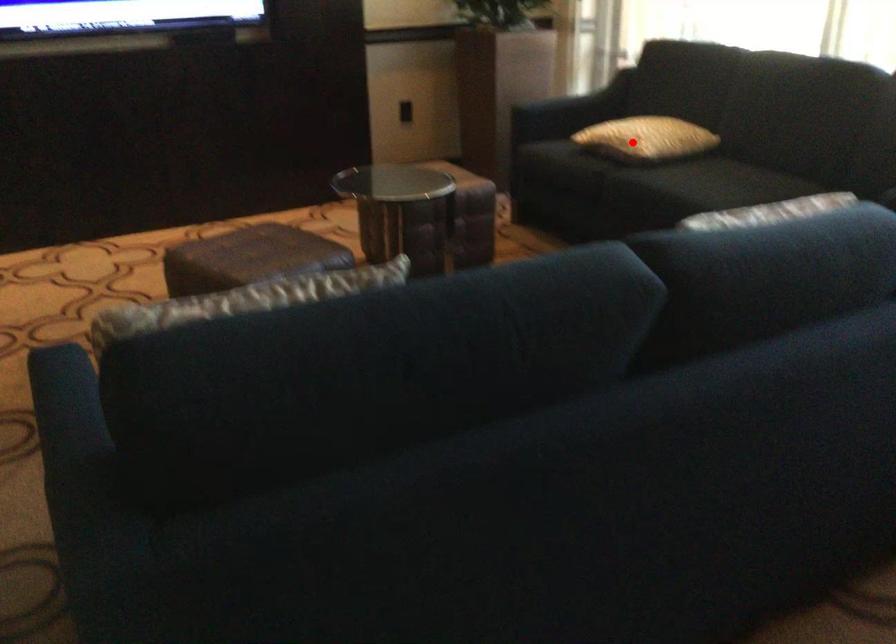
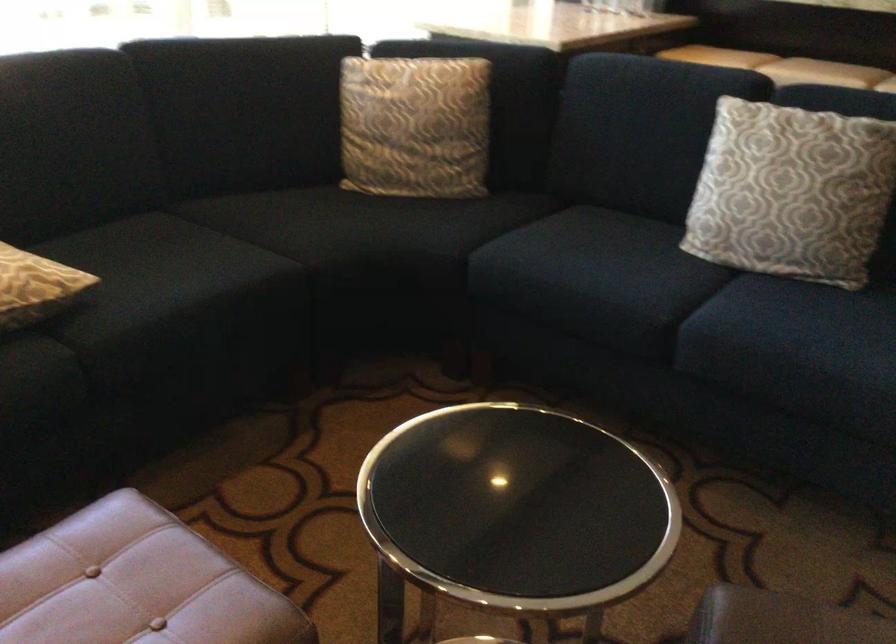
Question: A red point is marked in image1. In image2, is the corresponding 3D point closer to the camera or farther? Reply with the corresponding letter.

Choices:
 (A) The corresponding 3D point is closer.
 (B) The corresponding 3D point is farther.

Answer: (A)